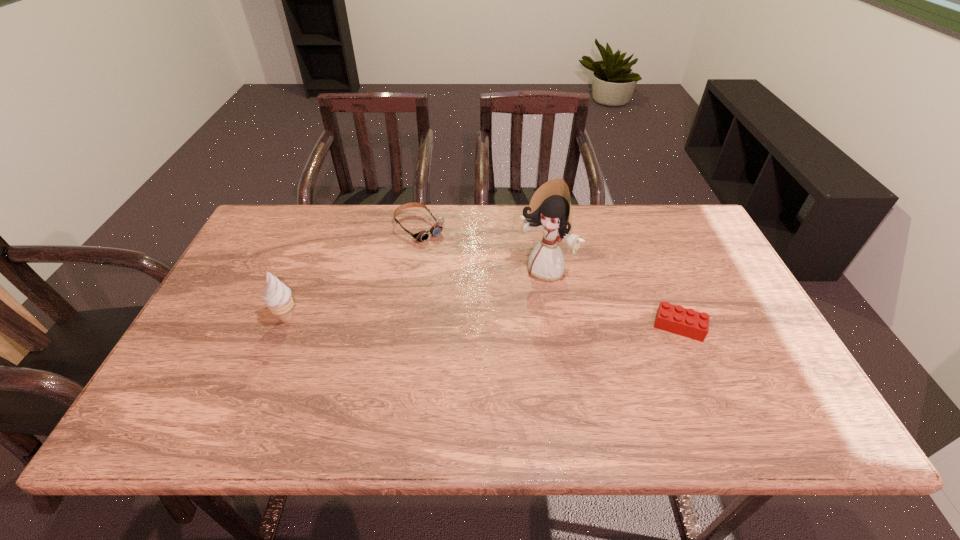
The height and width of the screenshot is (540, 960). What are the coordinates of `unoccupied area between the second object from right to left and the farthest object` in the screenshot? It's located at (483, 249).

Locate which object ranks in proximity to the Lego. Please provide its 2D coordinates. Your answer should be formatted as a tuple, i.e. [(x, y)], where the tuple contains the x and y coordinates of a point satisfying the conditions above.

[(550, 209)]

Identify which object is the second closest to the farthest object. Please provide its 2D coordinates. Your answer should be formatted as a tuple, i.e. [(x, y)], where the tuple contains the x and y coordinates of a point satisfying the conditions above.

[(278, 299)]

At what (x,y) coordinates should I click in order to perform the action: click on blank space that satisfies the following two spatial constraints: 1. on the front side of the shortest object; 2. on the left side of the farthest object. Please return your answer as a coordinate pair (x, y). Looking at the image, I should click on (404, 326).